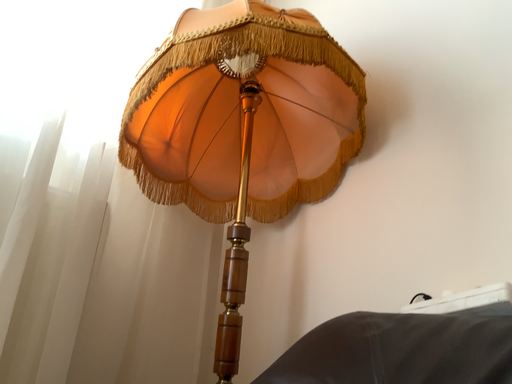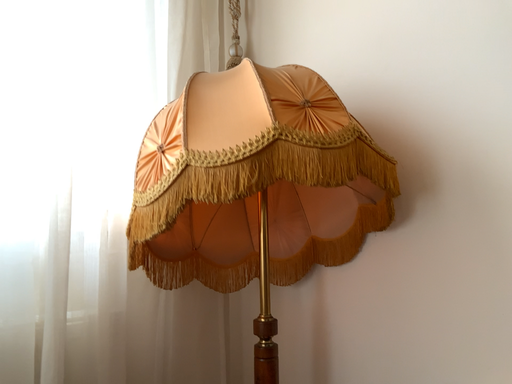
Question: How did the camera likely rotate when shooting the video?

Choices:
 (A) rotated upward
 (B) rotated downward

Answer: (B)